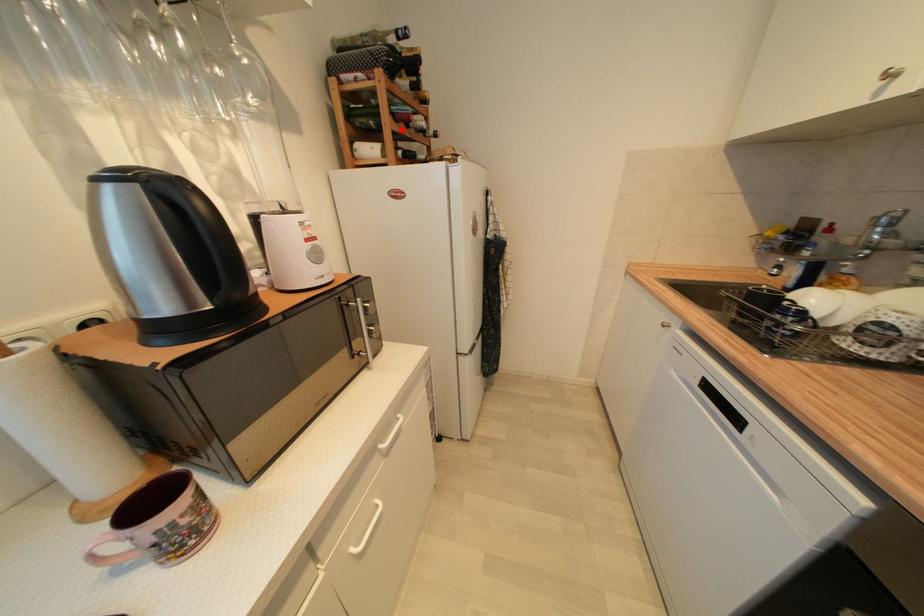
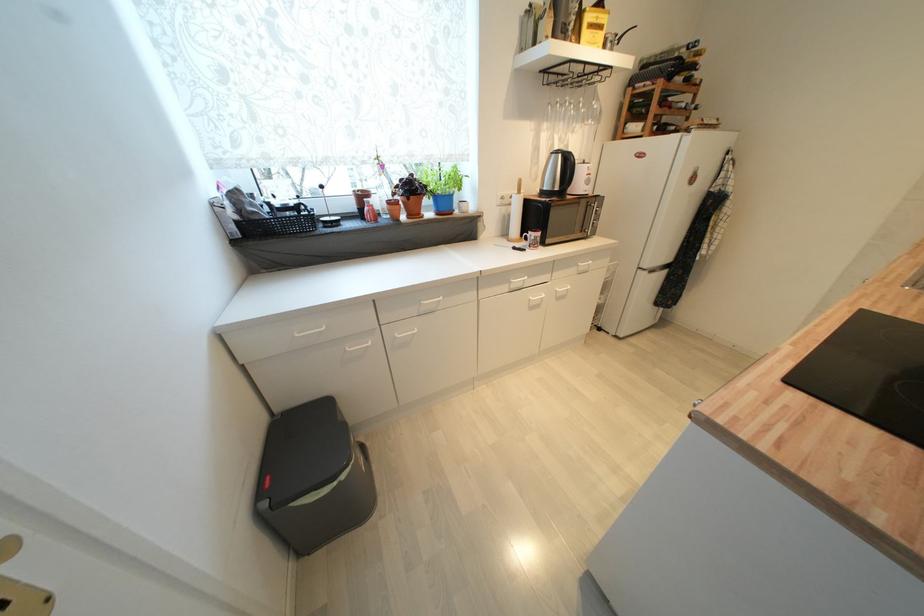
Locate, in the second image, the point that corresponds to the highlighted location in the first image.

(664, 114)